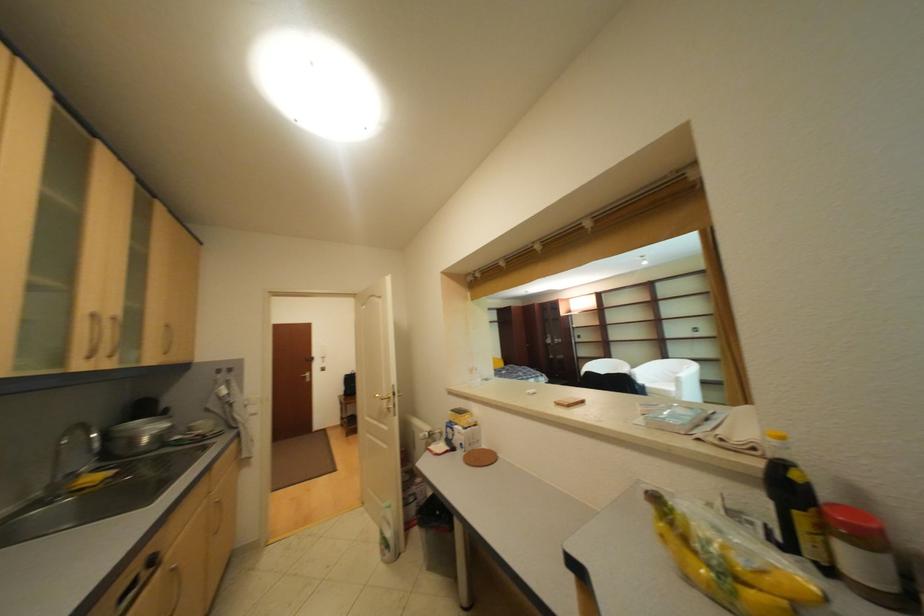
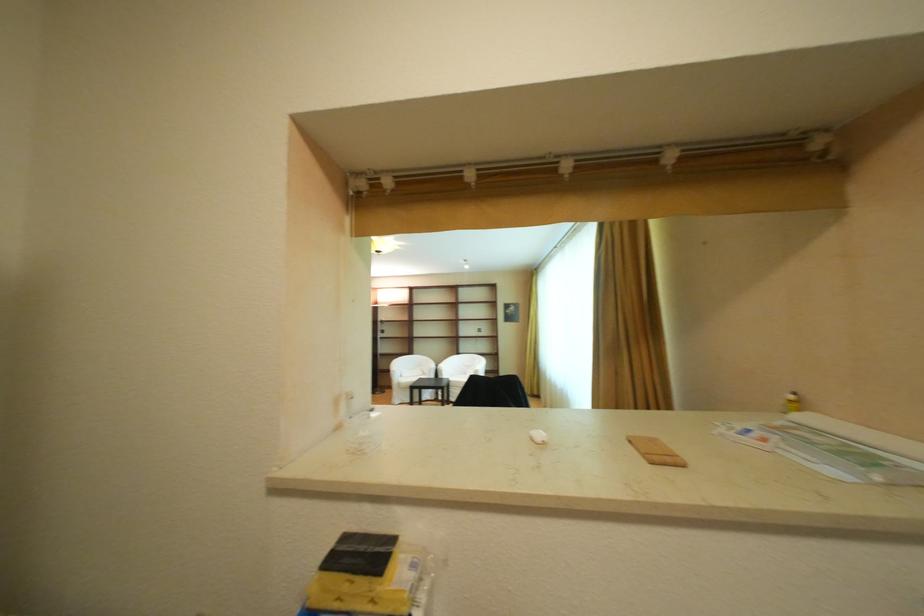
Locate, in the second image, the point that corresponds to (634,363) in the first image.

(436, 359)